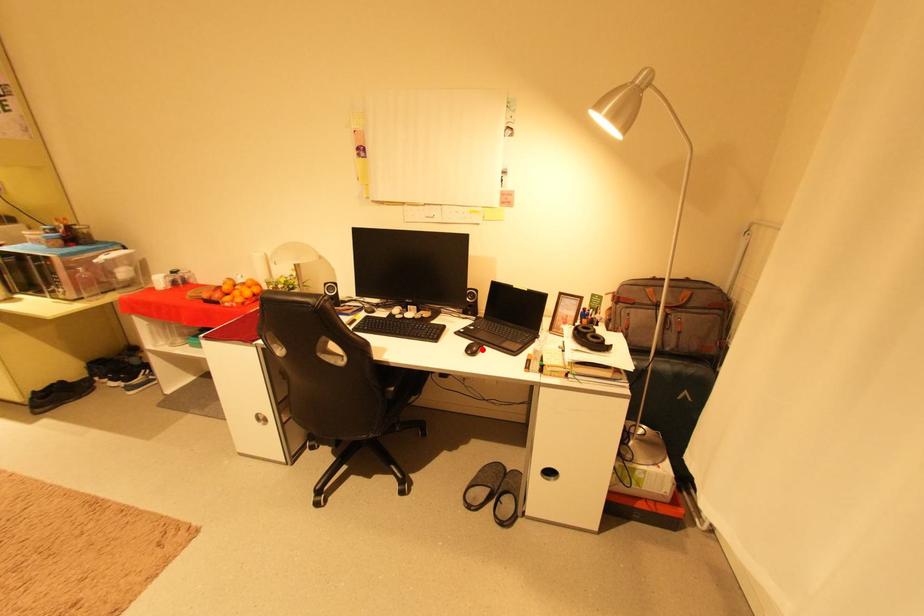
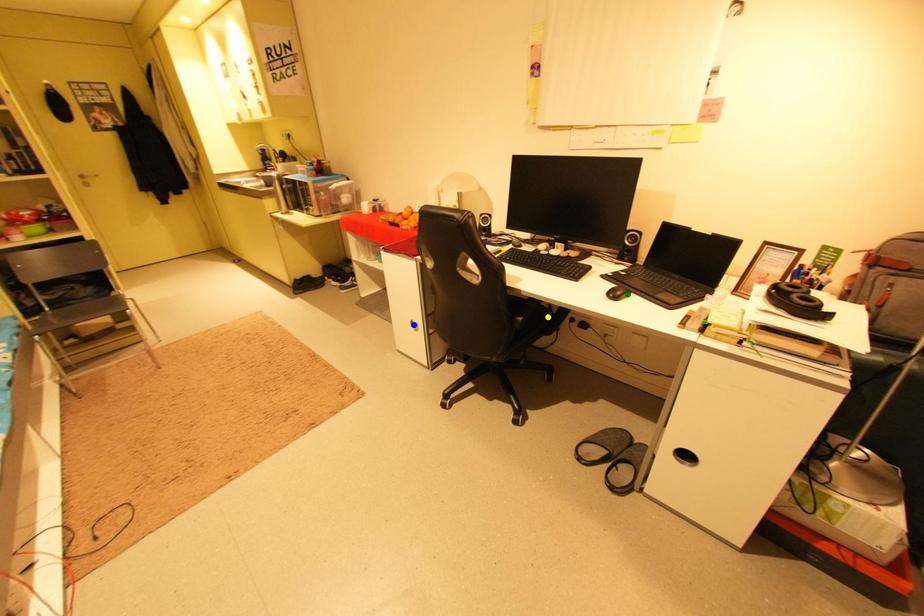
Question: I am providing you with two images of the same scene from different viewpoints. A red point is marked on the first image. You are given multiple points on the second image. Can you choose the point in image 2 that corresponds to the point in image 1?

Choices:
 (A) blue point
 (B) green point
 (C) yellow point

Answer: (B)